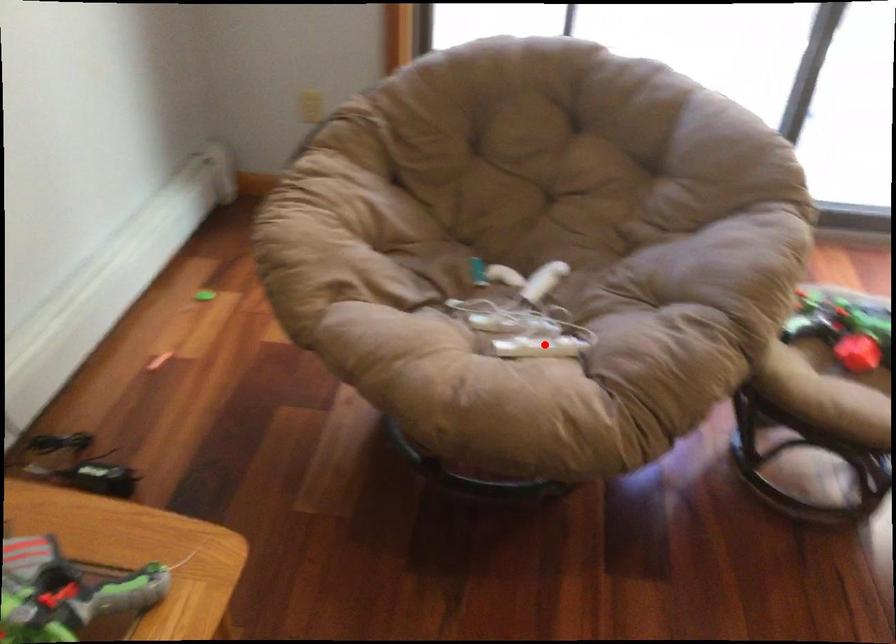
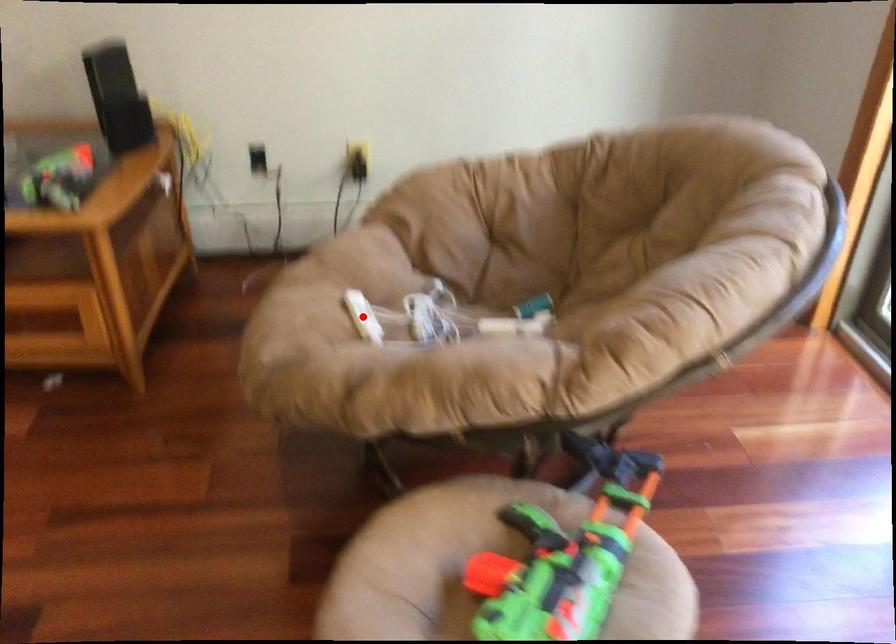
I am providing you with two images of the same scene from different viewpoints. A red point is marked on the first image and another point is marked on the second image. Do the highlighted points in image1 and image2 indicate the same real-world spot?

Yes